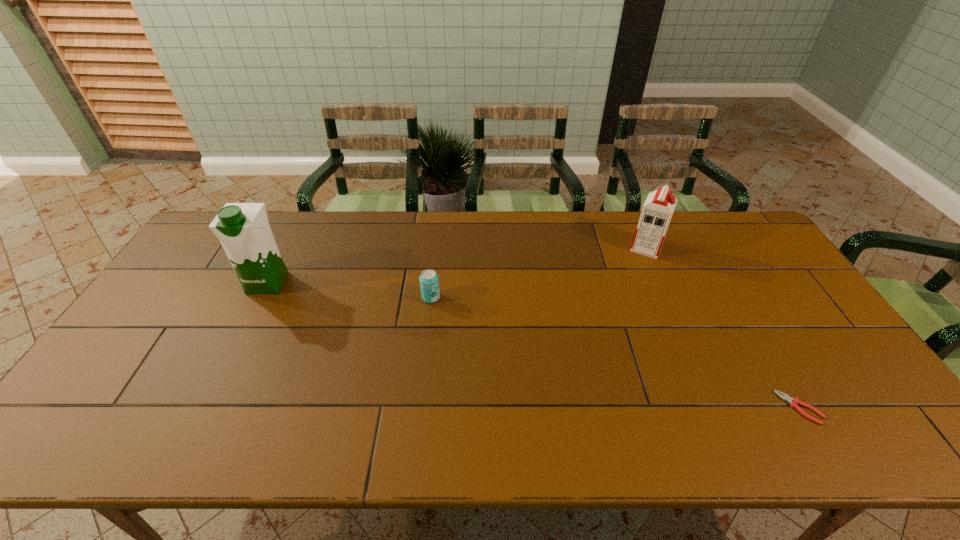
This screenshot has height=540, width=960. I want to click on vacant position located 0.280m on the left of the beer can, so click(327, 298).

Locate an element on the screen. free space located 0.250m on the back of the shortest object is located at coordinates pos(746,315).

The width and height of the screenshot is (960, 540). What are the coordinates of `object that is at the far edge` in the screenshot? It's located at (657, 211).

This screenshot has height=540, width=960. What are the coordinates of `object present at the near edge` in the screenshot? It's located at (784, 396).

Locate an element on the screen. object present at the right edge is located at coordinates (784, 396).

The image size is (960, 540). Find the location of `object present at the near right corner`. object present at the near right corner is located at coordinates (784, 396).

Where is `vacant space at the far edge of the desktop`? vacant space at the far edge of the desktop is located at coordinates (325, 218).

I want to click on free space at the near edge, so click(x=692, y=449).

This screenshot has width=960, height=540. I want to click on vacant space at the right edge, so click(733, 265).

Find the location of a particular element. This screenshot has height=540, width=960. free region at the far right corner of the desktop is located at coordinates point(708,230).